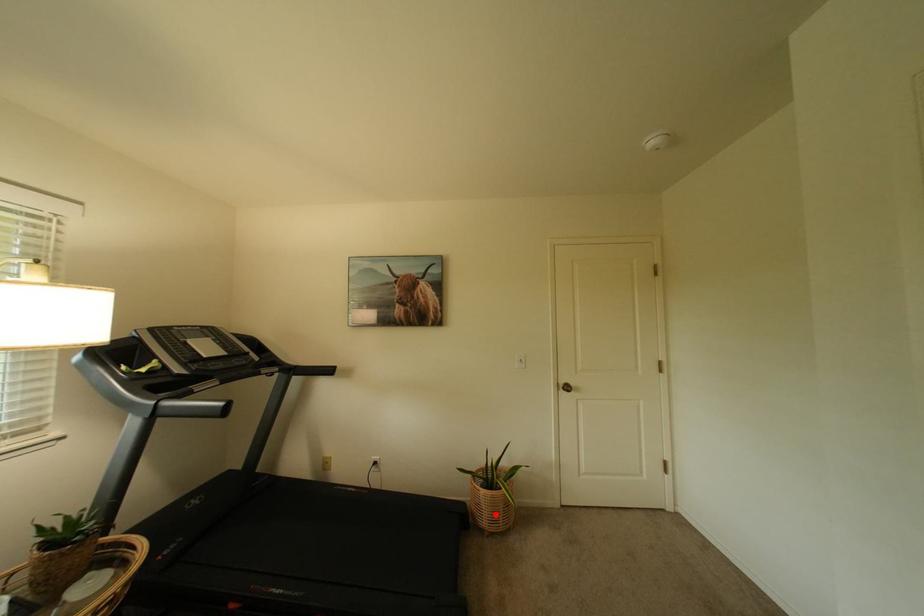
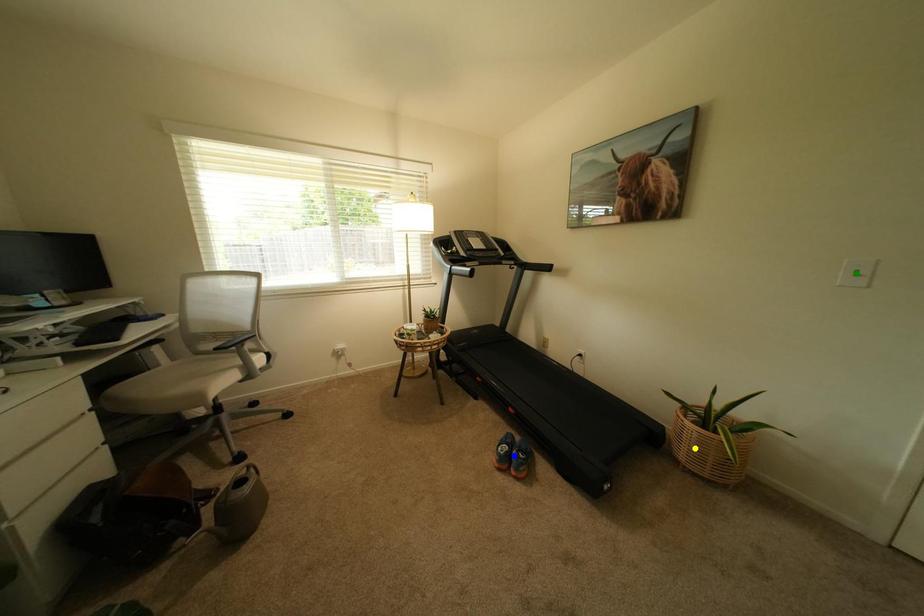
Question: I am providing you with two images of the same scene from different viewpoints. A red point is marked on the first image. You are given multiple points on the second image. Which spot in image 2 lines up with the point in image 1?

Choices:
 (A) yellow point
 (B) green point
 (C) blue point

Answer: (A)